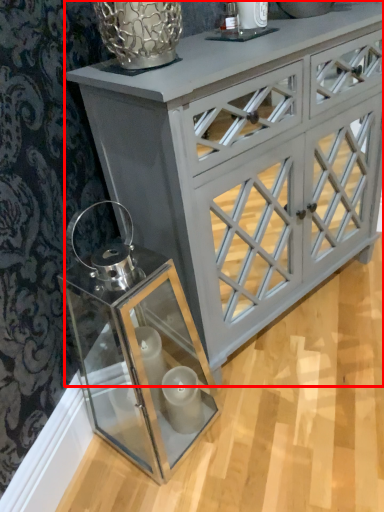
Question: From the image's perspective, where is chest of drawers (annotated by the red box) located in relation to glass box in the image?

Choices:
 (A) above
 (B) below

Answer: (A)